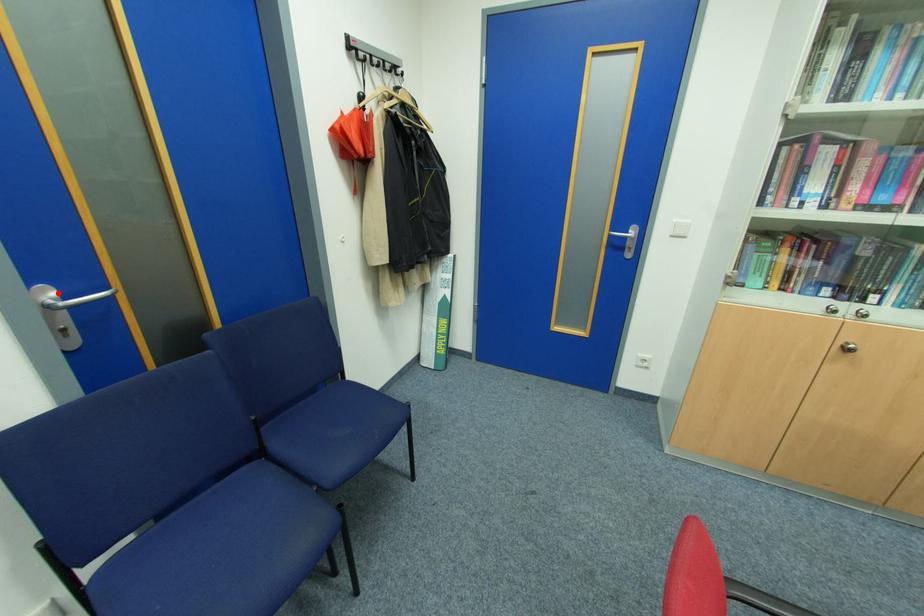
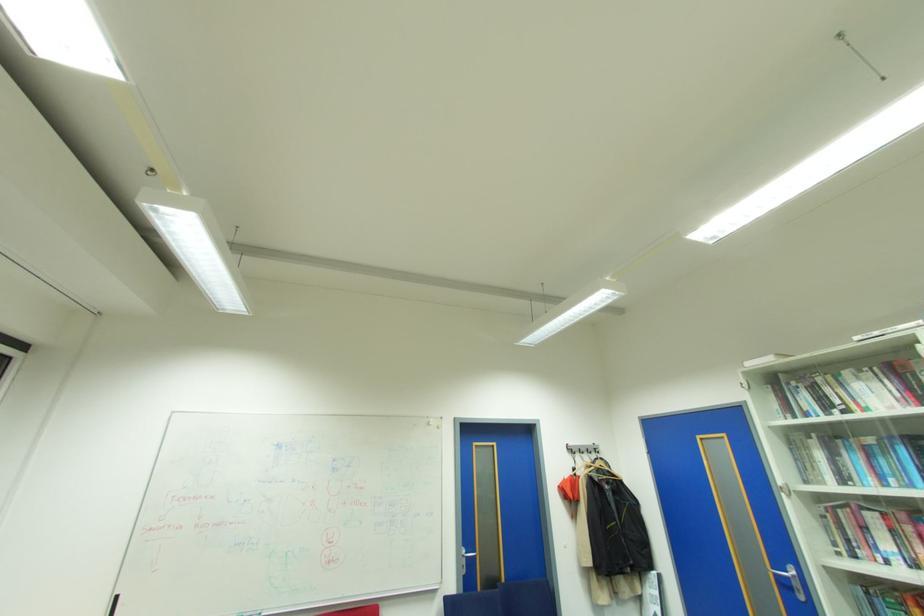
Where in the second image is the point corresponding to the highlighted location from the first image?

(468, 552)